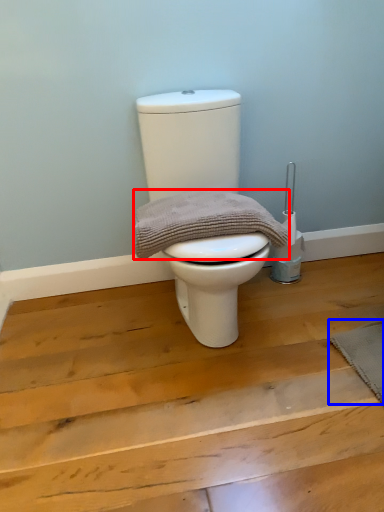
Question: Which object appears farthest to the camera in this image, material (highlighted by a red box) or doormat (highlighted by a blue box)?

Choices:
 (A) material
 (B) doormat

Answer: (B)